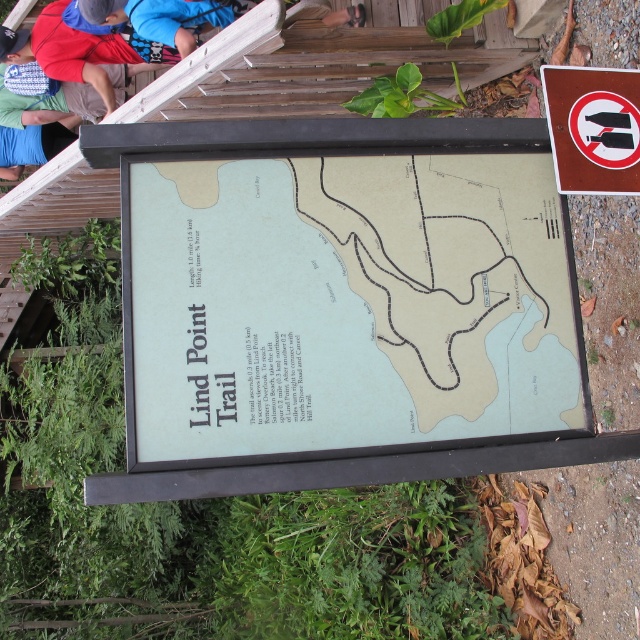
You are a hiker who wants to check the trail map but notices two items at the top of the sign. Which one is shorter between the white plastic sign at upper right and the blue fabric shirt at upper left?

The white plastic sign at upper right is shorter than the blue fabric shirt at upper left.

Consider the image. You are standing in front of the Lind Point Trail sign and notice the green paper map at center and the blue fabric shirt at upper left. Which object is nearer to you?

The green paper map at center is closer to the viewer than the blue fabric shirt at upper left.

You are planning to hike the Lind Point Trail and need to check the trail map. Which object on the sign should you look at first, the green paper map at center or the white plastic sign at upper right?

The green paper map at center has a larger size compared to the white plastic sign at upper right, so you should look at the green paper map at center first because it is bigger and likely contains more detailed information about the trail.